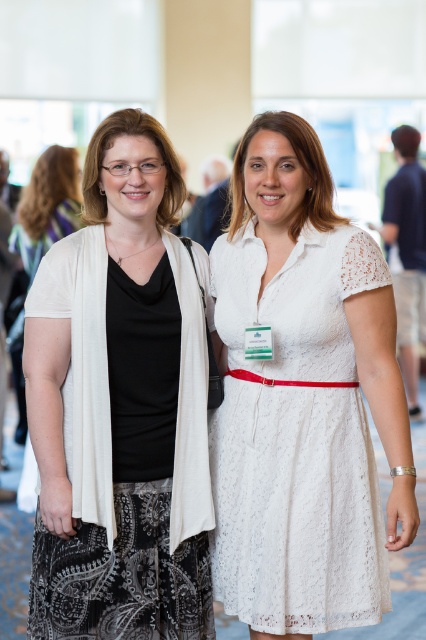
Question: Among these objects, which one is farthest from the camera?

Choices:
 (A) matte black top at left
 (B) white lace dress at center

Answer: (A)

Question: In this image, where is matte black top at left located relative to white lace dress at center?

Choices:
 (A) above
 (B) below

Answer: (A)

Question: Is matte black top at left above white lace dress at center?

Choices:
 (A) yes
 (B) no

Answer: (A)

Question: Which point is farther to the camera?

Choices:
 (A) (233, 364)
 (B) (63, 408)

Answer: (A)

Question: Is matte black top at left positioned before white lace dress at center?

Choices:
 (A) no
 (B) yes

Answer: (A)